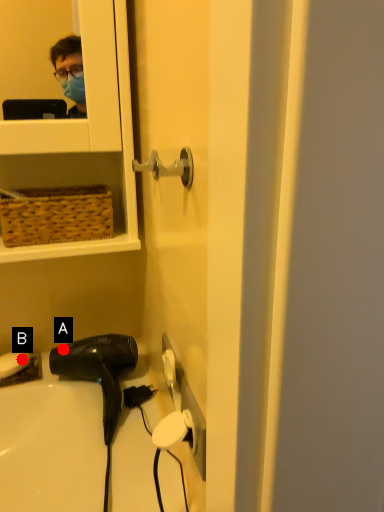
Question: Two points are circled on the image, labeled by A and B beside each circle. Which point is farther to the camera?

Choices:
 (A) A is further
 (B) B is further

Answer: (B)